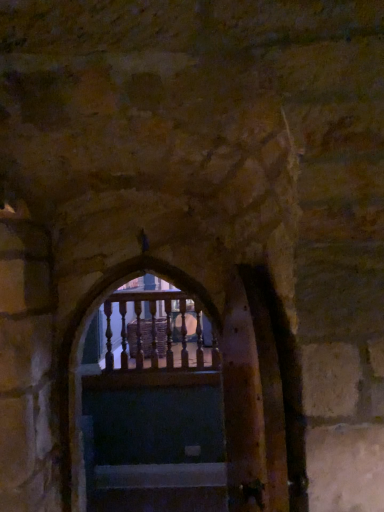
Question: Does point (132, 323) appear closer or farther from the camera than point (218, 503)?

Choices:
 (A) farther
 (B) closer

Answer: (A)

Question: In the image, is wooden balusters at center positioned in front of or behind wooden stairs at center?

Choices:
 (A) front
 (B) behind

Answer: (B)

Question: Based on their positions, is wooden balusters at center located to the left or right of wooden stairs at center?

Choices:
 (A) right
 (B) left

Answer: (B)

Question: Considering the positions of point (102, 497) and point (160, 324), is point (102, 497) closer or farther from the camera than point (160, 324)?

Choices:
 (A) farther
 (B) closer

Answer: (B)

Question: Is wooden stairs at center taller or shorter than wooden balusters at center?

Choices:
 (A) short
 (B) tall

Answer: (A)

Question: Looking at the image, does wooden stairs at center seem bigger or smaller compared to wooden balusters at center?

Choices:
 (A) small
 (B) big

Answer: (A)

Question: From the image's perspective, is wooden stairs at center above or below wooden balusters at center?

Choices:
 (A) below
 (B) above

Answer: (A)